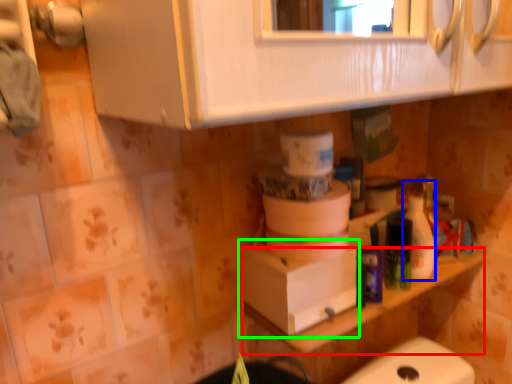
Question: Based on their relative distances, which object is nearer to counter top (highlighted by a red box)? Choose from cleaning product (highlighted by a blue box) and cardboard box (highlighted by a green box).

Choices:
 (A) cleaning product
 (B) cardboard box

Answer: (B)